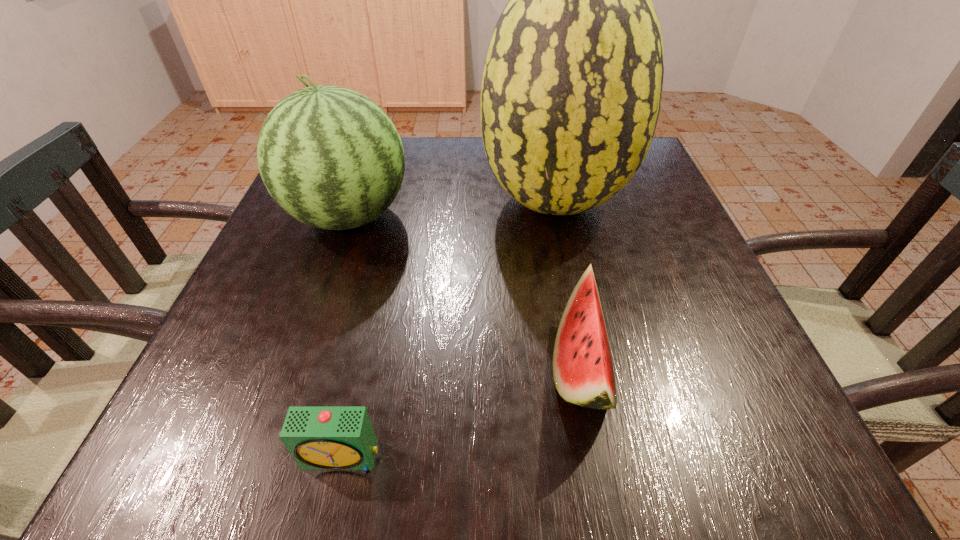
This screenshot has height=540, width=960. I want to click on free space located 0.340m on the outer rind of the shortest watermelon, so click(335, 367).

The image size is (960, 540). I want to click on watermelon that is at the near edge, so click(583, 373).

Identify the location of alarm clock positioned at the near edge. The width and height of the screenshot is (960, 540). (318, 437).

Locate an element on the screen. object at the left edge is located at coordinates (330, 157).

The image size is (960, 540). In order to click on object located at the right edge in this screenshot , I will do `click(571, 91)`.

Locate an element on the screen. This screenshot has height=540, width=960. object that is positioned at the far left corner is located at coordinates (330, 157).

What are the coordinates of `object situated at the far right corner` in the screenshot? It's located at (571, 91).

In the image, there is a desktop. What are the coordinates of `vacant space at the near edge` in the screenshot? It's located at (318, 474).

You are a GUI agent. You are given a task and a screenshot of the screen. Output one action in this format:
    pyautogui.click(x=<x>, y=<y>)
    Task: Click on the vacant point at the left edge
    The height and width of the screenshot is (540, 960).
    Given the screenshot: What is the action you would take?
    pyautogui.click(x=312, y=307)

Locate an element on the screen. Image resolution: width=960 pixels, height=540 pixels. free region at the right edge of the desktop is located at coordinates (685, 235).